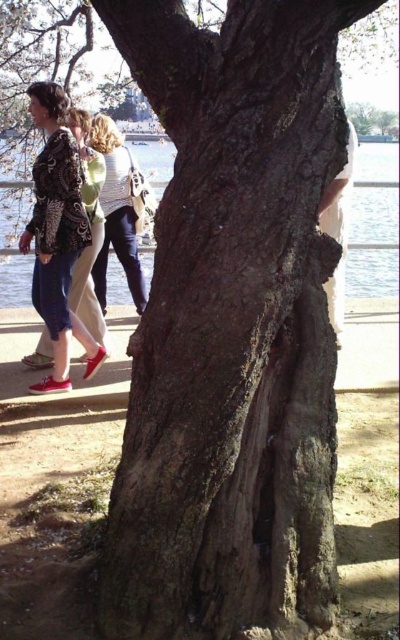
Is matte white sweater at upper left to the right of matte black jacket at left from the viewer's perspective?

Indeed, matte white sweater at upper left is positioned on the right side of matte black jacket at left.

Does point (106, 164) come in front of point (77, 300)?

No, (106, 164) is further to viewer.

Does point (131, 161) come closer to viewer compared to point (86, 154)?

No, (131, 161) is further to viewer.

Where is `matte white sweater at upper left`? This screenshot has height=640, width=400. matte white sweater at upper left is located at coordinates (116, 212).

Does clear water at center have a lesser width compared to matte white sweater at upper left?

No.

Between point (360, 212) and point (98, 124), which one is positioned in front?

Positioned in front is point (98, 124).

Find the location of `clear water at center`. clear water at center is located at coordinates pos(375,195).

Can you confirm if rough bark tree trunk at center is taller than clear water at center?

Yes, rough bark tree trunk at center is taller than clear water at center.

Does rough bark tree trunk at center have a lesser height compared to clear water at center?

No, rough bark tree trunk at center is not shorter than clear water at center.

Find the location of a particular element. rough bark tree trunk at center is located at coordinates (231, 328).

Where is `rough bark tree trunk at center`? The image size is (400, 640). rough bark tree trunk at center is located at coordinates (231, 328).